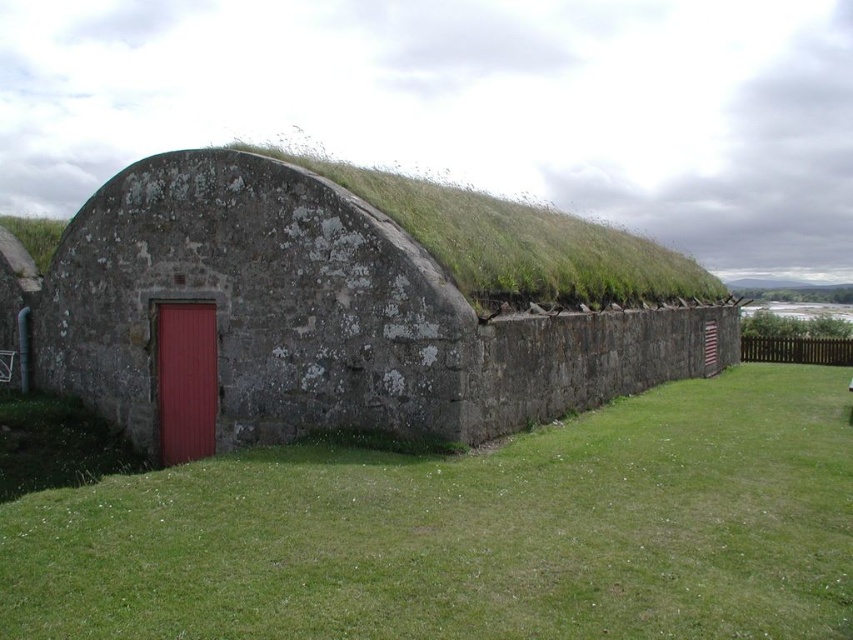
Is green grass at center wider than rustic stone hut at center?

Incorrect, green grass at center's width does not surpass rustic stone hut at center's.

Between point (820, 452) and point (57, 385), which one is positioned behind?

The point (57, 385) is behind.

Find the location of a particular element. Image resolution: width=853 pixels, height=640 pixels. green grass at center is located at coordinates (473, 532).